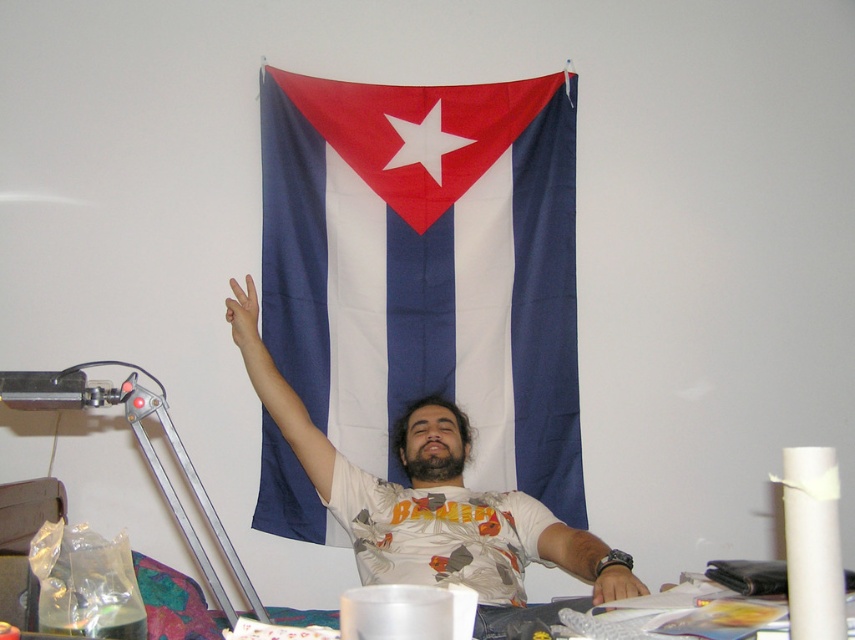
You are a photographer trying to capture a photo of the blue fabric flag at center and the matte white arm at center. The camera you are using has a minimum focus distance of 24 inches. Can you take a clear photo of both objects without moving them?

The blue fabric flag at center and the matte white arm at center are 26.31 inches apart. Since the camera has a minimum focus distance of 24 inches, you can take a clear photo of both objects without moving them because the distance between them is greater than the minimum focus distance.

You are standing in the room and want to reach the white matte arm at upper center to adjust its position. Considering your height is 1.7 meters, can you comfortably reach it without using a stool?

The white matte arm at upper center is 2.68 meters away from the viewer. Since the viewer is 1.7 meters tall, they cannot comfortably reach it without a stool as the distance exceeds their height.